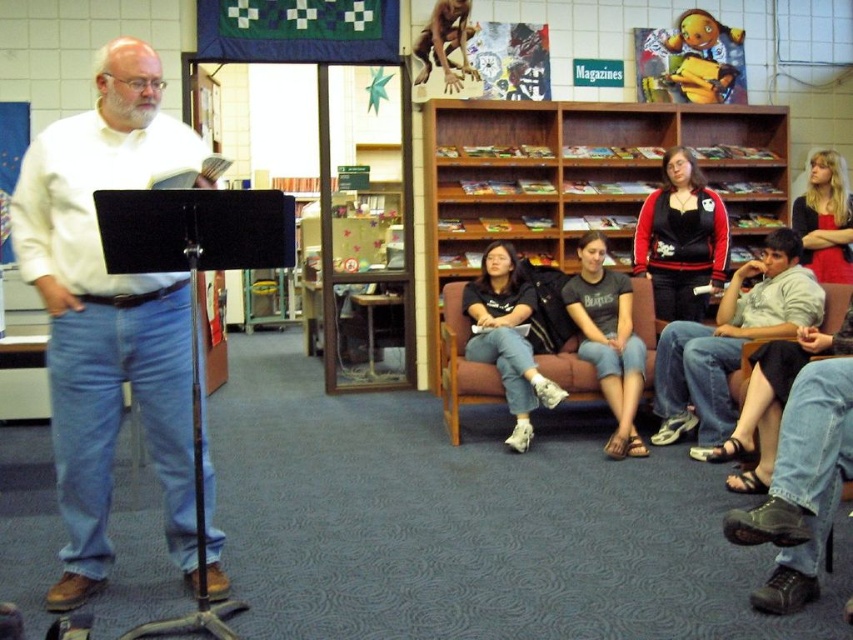
Question: Can you confirm if black cotton shirt at center is wider than dark gray t-shirt at center?

Choices:
 (A) yes
 (B) no

Answer: (A)

Question: Which object is closer to the camera taking this photo?

Choices:
 (A) white shirt at left
 (B) gray cotton shirt at lower right
 (C) dark gray t-shirt at center

Answer: (A)

Question: Is white shirt at left wider than wooden bookshelf at center?

Choices:
 (A) no
 (B) yes

Answer: (A)

Question: Considering the real-world distances, which object is closest to the dark gray t-shirt at center?

Choices:
 (A) gray cotton shirt at lower right
 (B) white shirt at left
 (C) black cotton shirt at center

Answer: (C)

Question: Which of these objects is positioned closest to the gray cotton shirt at lower right?

Choices:
 (A) dark gray t-shirt at center
 (B) white shirt at left
 (C) wooden bookshelf at center
 (D) black cotton shirt at center

Answer: (A)

Question: Is white shirt at left further to camera compared to wooden bookshelf at center?

Choices:
 (A) yes
 (B) no

Answer: (B)